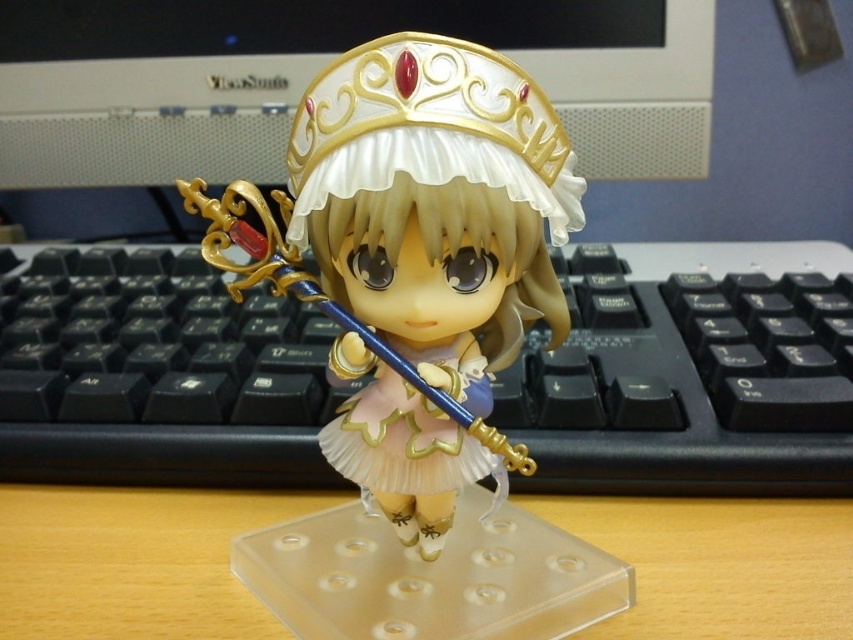
You are trying to place a new decoration on the desk. The decoration is 10 cm tall. You see the white glossy crown at upper center and the wooden desk at center. Can the decoration fit on the desk without exceeding the height of the crown?

The white glossy crown at upper center is much taller than the wooden desk at center. Since the decoration is only 10 cm tall, it can fit on the desk without exceeding the crown height as long as its height is less than the crown.

You are organizing items on a desk and see the black plastic keyboard at center and the matte gold crown at center. Which item is positioned to the right of the other?

The black plastic keyboard at center is to the right of the matte gold crown at center.